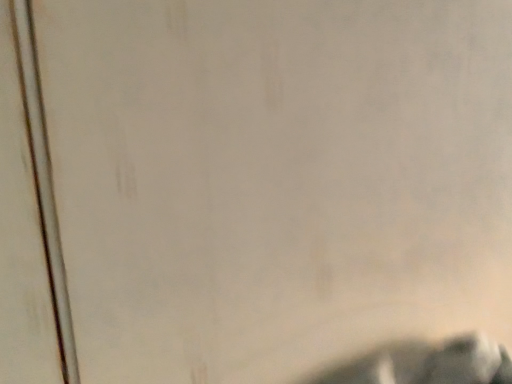
Describe the element at coordinates (430, 364) in the screenshot. The width and height of the screenshot is (512, 384). I see `shiny metallic cat at bottom right` at that location.

The height and width of the screenshot is (384, 512). I want to click on shiny metallic cat at bottom right, so click(430, 364).

This screenshot has width=512, height=384. In order to click on shiny metallic cat at bottom right in this screenshot , I will do `click(430, 364)`.